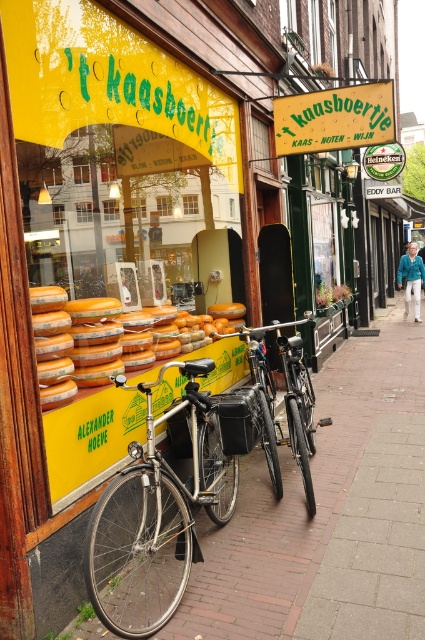
Question: Can you confirm if brick pavement at center is thinner than orange cheese at center?

Choices:
 (A) yes
 (B) no

Answer: (B)

Question: Does shiny silver bicycle at center appear under shiny metallic bicycle at center?

Choices:
 (A) no
 (B) yes

Answer: (B)

Question: Estimate the real-world distances between objects in this image. Which object is closer to the orange cheese at center?

Choices:
 (A) brick pavement at center
 (B) shiny metallic bicycle at center
 (C) shiny silver bicycle at center

Answer: (C)

Question: Does shiny silver bicycle at center come in front of shiny metallic bicycle at center?

Choices:
 (A) no
 (B) yes

Answer: (B)

Question: Among these points, which one is nearest to the camera?

Choices:
 (A) (351, 376)
 (B) (295, 400)

Answer: (B)

Question: Which point is closer to the camera?

Choices:
 (A) shiny metallic bicycle at center
 (B) brick pavement at center

Answer: (B)